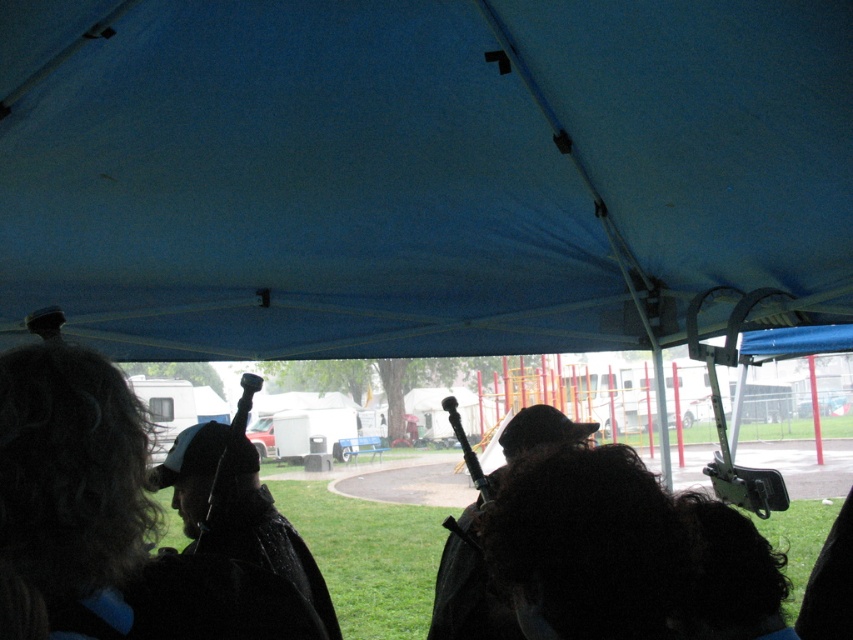
Is point (254, 556) in front of point (242, 403)?

No, it is not.

Does black matte jacket at lower left have a larger size compared to metallic black microphone at center?

Yes, black matte jacket at lower left is bigger than metallic black microphone at center.

Between point (283, 541) and point (247, 400), which one is positioned behind?

Positioned behind is point (283, 541).

This screenshot has height=640, width=853. I want to click on black matte jacket at lower left, so click(x=238, y=513).

Is black matte jacket at lower left above dark brown leather bag at center?

No.

Does black matte jacket at lower left come in front of dark brown leather bag at center?

Yes, it is.

Who is more distant from viewer, (270, 500) or (469, 556)?

Point (469, 556)

You are a GUI agent. You are given a task and a screenshot of the screen. Output one action in this format:
    pyautogui.click(x=<x>, y=<y>)
    Task: Click on the black matte jacket at lower left
    
    Given the screenshot: What is the action you would take?
    pyautogui.click(x=238, y=513)

Which is behind, point (134, 401) or point (456, 632)?

Positioned behind is point (456, 632).

Does point (32, 541) lie behind point (469, 536)?

No, (32, 541) is in front of (469, 536).

The width and height of the screenshot is (853, 640). What are the coordinates of `dark curly hair at lower left` in the screenshot? It's located at (67, 483).

You are a GUI agent. You are given a task and a screenshot of the screen. Output one action in this format:
    pyautogui.click(x=<x>, y=<y>)
    Task: Click on the dark curly hair at lower left
    This screenshot has width=853, height=640.
    Given the screenshot: What is the action you would take?
    pyautogui.click(x=67, y=483)